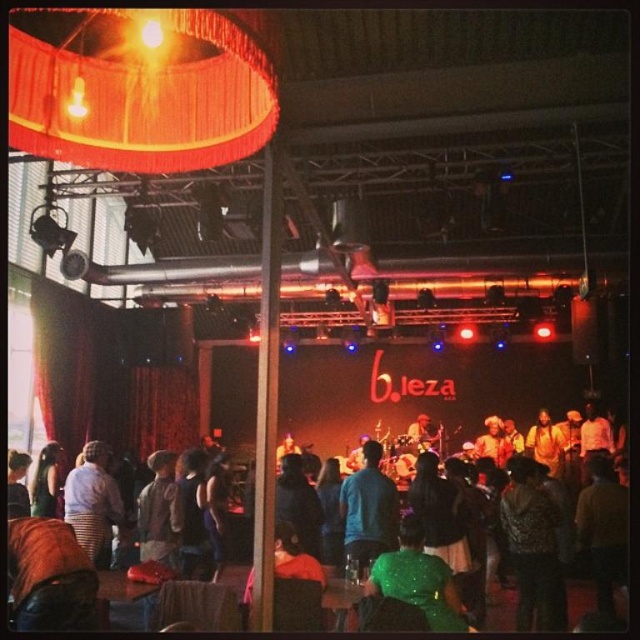
You are attending a concert at the venue named Bleza. You are standing at the point marked as point (115, 588) and want to move to the exit located at point (81, 529). Is the exit behind you or in front of you?

The exit at point (81, 529) is behind you because point (81, 529) is behind point (115, 588).

You are at the concert venue and want to take a photo of the striped shirt at lower left. The venue has a rule that photos can only be taken if the subject is within a specific area marked by the point coordinates. Is the striped shirt at lower left within the area defined by point coordinates at (x=92, y=502)?

The striped shirt at lower left is located exactly at point coordinates (x=92, y=502), so it is within the specified area.

You are a photographer at the concert venue and need to capture a photo of both the blue denim jacket at center and the green sequined dress at center. Which one should you focus on first if you want to include both in the frame without moving the camera?

The blue denim jacket at center is positioned on the left side of the green sequined dress at center, so you should focus on the blue denim jacket at center first to ensure both are in the frame.